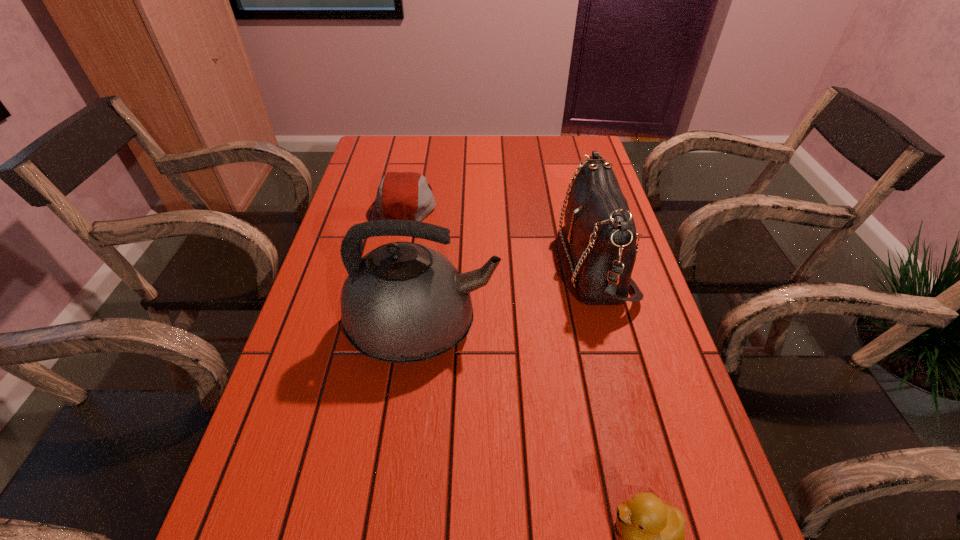
Where is `object situated at the right edge`? object situated at the right edge is located at coordinates (600, 229).

This screenshot has width=960, height=540. What are the coordinates of `vacant space at the far edge` in the screenshot? It's located at (444, 157).

I want to click on vacant area at the left edge, so click(x=313, y=353).

I want to click on vacant space at the right edge of the desktop, so click(x=624, y=359).

Identify the location of free space at the far right corner. The image size is (960, 540). pos(564,155).

The height and width of the screenshot is (540, 960). I want to click on vacant area that lies between the second tallest object and the tallest object, so click(x=509, y=295).

Where is `unoccupied position between the tallest object and the second tallest object`? unoccupied position between the tallest object and the second tallest object is located at coordinates (509, 295).

Where is `unoccupied area between the cap and the second tallest object`? unoccupied area between the cap and the second tallest object is located at coordinates (501, 233).

Choose which object is the third nearest neighbor to the cap. Please provide its 2D coordinates. Your answer should be formatted as a tuple, i.e. [(x, y)], where the tuple contains the x and y coordinates of a point satisfying the conditions above.

[(653, 532)]

Identify the location of object that ranks as the third closest to the second tallest object. (653, 532).